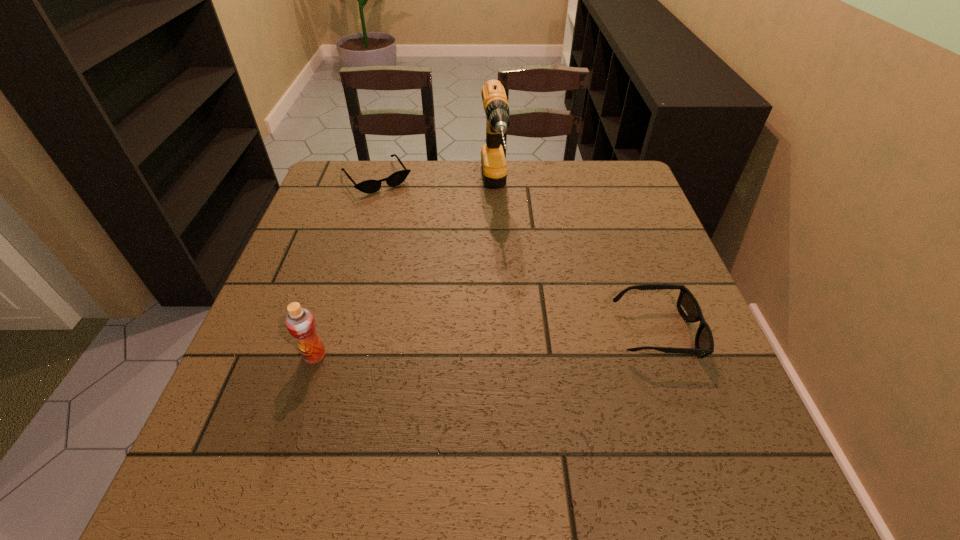
Identify the location of free location that satisfies the following two spatial constraints: 1. on the back side of the orange juice; 2. on the front-facing side of the second shortest object. (323, 333).

Where is `free space that satisfies the following two spatial constraints: 1. on the front side of the rightmost object; 2. on the front-facing side of the tallest object`? free space that satisfies the following two spatial constraints: 1. on the front side of the rightmost object; 2. on the front-facing side of the tallest object is located at coordinates (499, 333).

Identify the location of vacant space that satisfies the following two spatial constraints: 1. on the front side of the right sunglasses; 2. on the front-facing side of the shortest object. Image resolution: width=960 pixels, height=540 pixels. (330, 333).

Find the location of `blank space that satisfies the following two spatial constraints: 1. on the back side of the rightmost object; 2. on the front-facing side of the orange juice`. blank space that satisfies the following two spatial constraints: 1. on the back side of the rightmost object; 2. on the front-facing side of the orange juice is located at coordinates (323, 333).

I want to click on vacant area in the image that satisfies the following two spatial constraints: 1. on the back side of the shorter sunglasses; 2. on the right side of the orange juice, so click(372, 178).